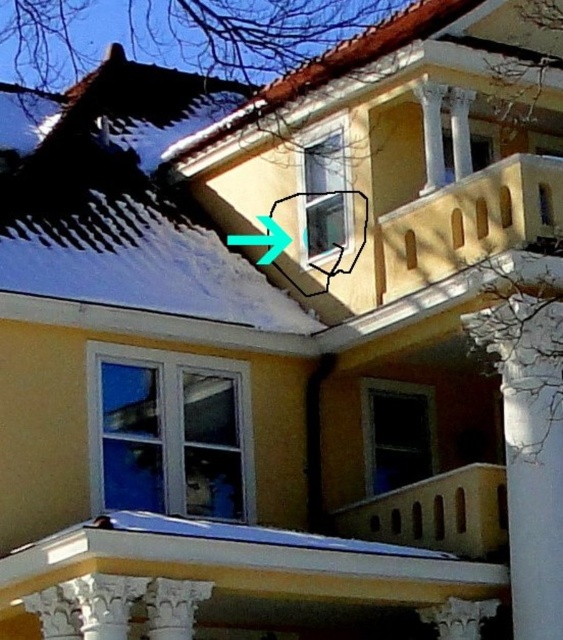
You are a delivery person trying to locate the correct window on the second floor of the building. The green plastic arrow at upper center is pointing towards the window you need. However, there are multiple windows on the second floor. How can the smooth shingles roof at upper center help you identify the correct window?

The smooth shingles roof at upper center is wider than the green plastic arrow at upper center. Since the arrow is pointing towards the window, the roof can help you identify the correct window by noting that the window under the wider roof section indicated by the arrow is the target.

Based on the photo, you are a delivery person trying to locate the correct window for a package. You see the smooth shingles roof at upper center and the green plastic arrow at upper center. Which object is bigger in size?

The smooth shingles roof at upper center is larger in size than the green plastic arrow at upper center.